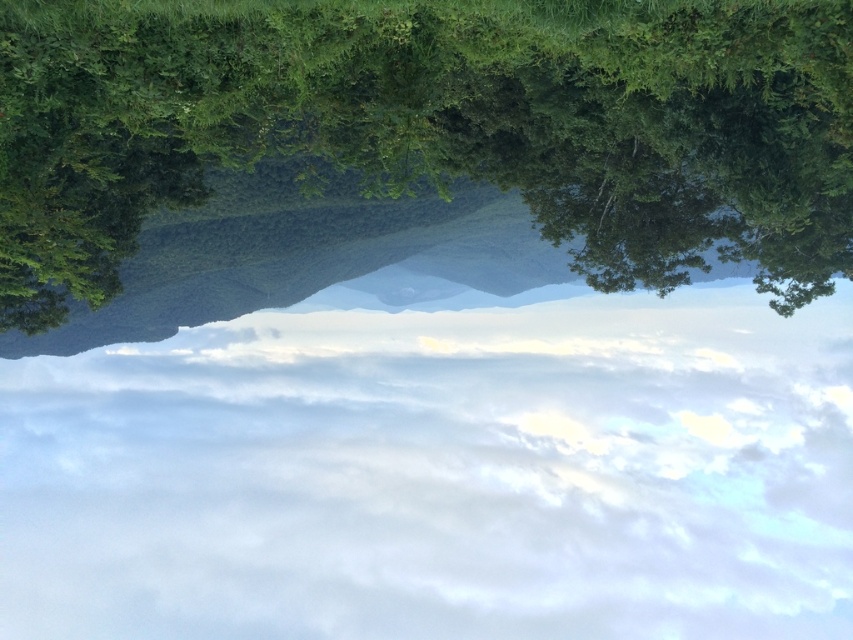
Question: Does white fluffy cloud at center come behind green leafy tree at upper center?

Choices:
 (A) yes
 (B) no

Answer: (A)

Question: Is white fluffy cloud at center wider than green leafy tree at upper center?

Choices:
 (A) no
 (B) yes

Answer: (B)

Question: Which point appears closest to the camera in this image?

Choices:
 (A) (74, 76)
 (B) (480, 364)

Answer: (A)

Question: Which of the following is the closest to the observer?

Choices:
 (A) (291, 380)
 (B) (120, 68)

Answer: (B)

Question: From the image, what is the correct spatial relationship of white fluffy cloud at center in relation to green leafy tree at upper center?

Choices:
 (A) below
 (B) above

Answer: (A)

Question: Which point is farther from the camera taking this photo?

Choices:
 (A) (152, 408)
 (B) (846, 248)

Answer: (A)